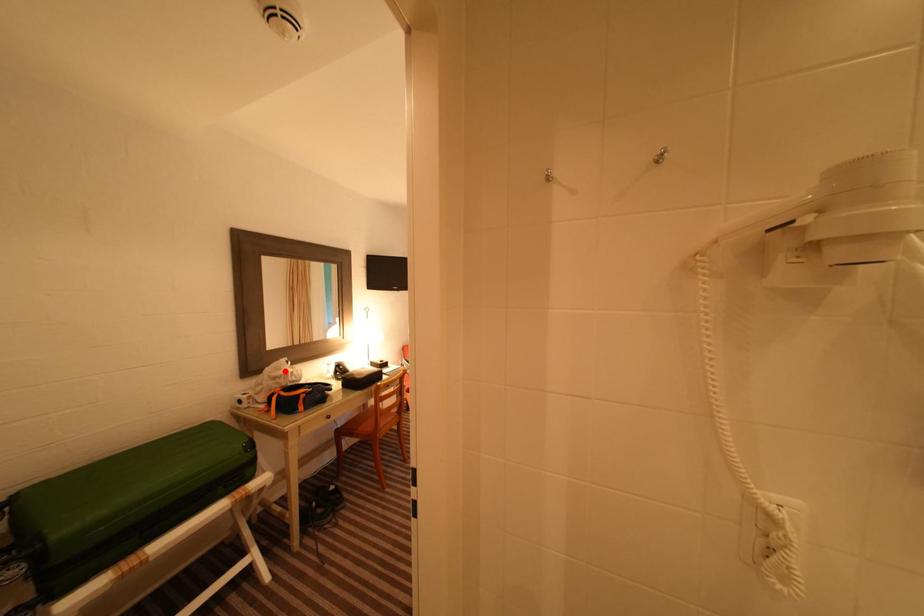
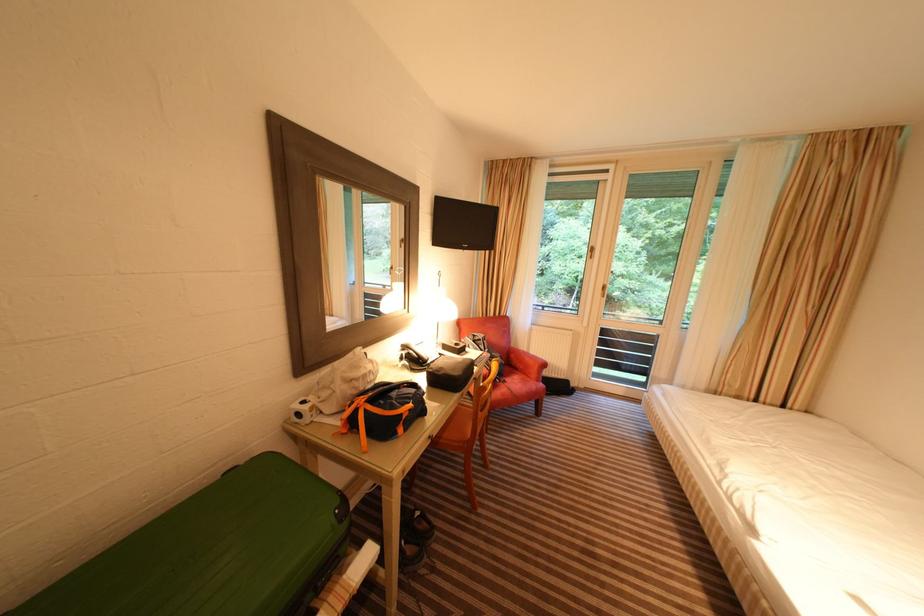
The point at the highlighted location is marked in the first image. Where is the corresponding point in the second image?

(361, 369)